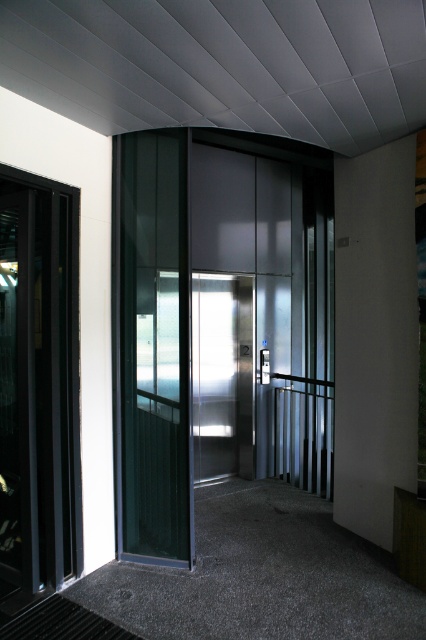
You are an interior designer assessing the elevator lobby. You notice two elevators at the center of the scene. Which one is taller between the satin silver elevator at center and the transparent glass elevator at center?

The satin silver elevator at center is taller than the transparent glass elevator at center.

You are an architect designing a new building and need to choose between the satin silver elevator at center and the transparent glass elevator at center for the elevator lobby. Based on their sizes, which elevator would allow for more passengers?

The satin silver elevator at center is larger in size than the transparent glass elevator at center, so it can accommodate more passengers.